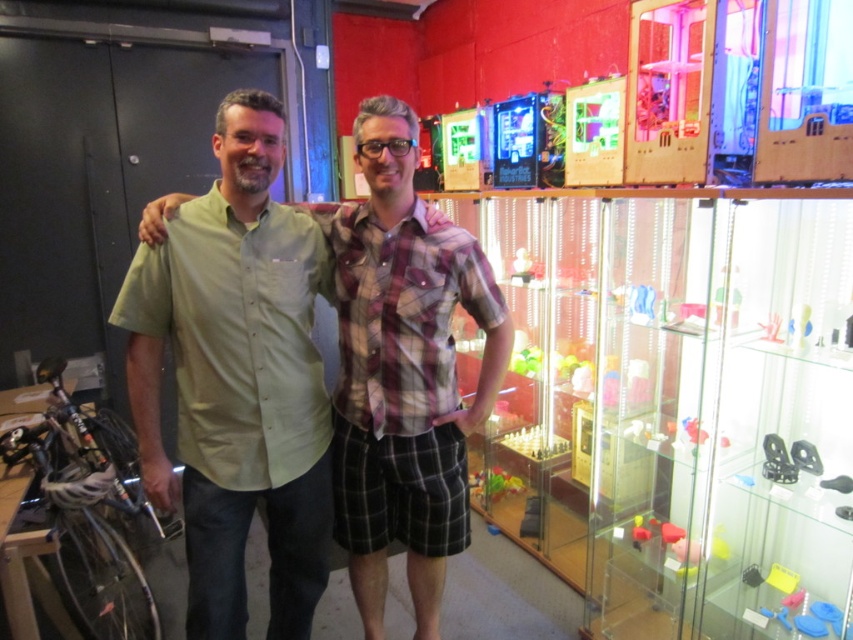
Question: Is the position of clear acrylic display case at right more distant than that of green cotton shirt at center?

Choices:
 (A) yes
 (B) no

Answer: (B)

Question: Does clear acrylic display case at right appear on the left side of green cotton shirt at center?

Choices:
 (A) no
 (B) yes

Answer: (A)

Question: Does clear acrylic display case at right have a lesser width compared to green cotton shirt at center?

Choices:
 (A) no
 (B) yes

Answer: (A)